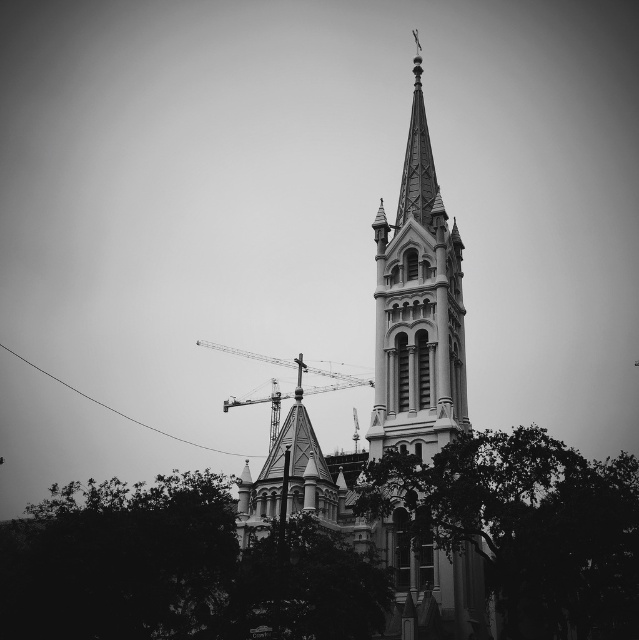
Question: Which object is the closest to the green leafy tree at lower right?

Choices:
 (A) metallic construction crane at center
 (B) polished stone church steeple at center

Answer: (B)

Question: Does green leafy tree at lower right have a larger size compared to metallic construction crane at center?

Choices:
 (A) no
 (B) yes

Answer: (B)

Question: Among these objects, which one is nearest to the camera?

Choices:
 (A) metallic construction crane at center
 (B) polished stone church steeple at center

Answer: (B)

Question: Can you confirm if green leafy tree at lower left is smaller than green leafy tree at lower right?

Choices:
 (A) no
 (B) yes

Answer: (B)

Question: Which is nearer to the green leafy tree at lower left?

Choices:
 (A) polished stone church steeple at center
 (B) green leafy tree at lower right
 (C) metallic construction crane at center

Answer: (B)

Question: Is the position of green leafy tree at lower left less distant than that of polished stone church steeple at center?

Choices:
 (A) no
 (B) yes

Answer: (B)